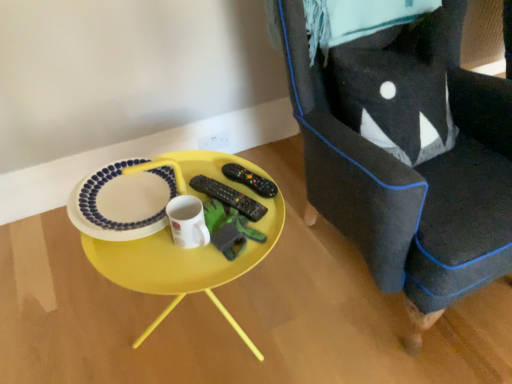
Where is `free spot below yellow plastic table at center (from a real-world perspective)`? Image resolution: width=512 pixels, height=384 pixels. free spot below yellow plastic table at center (from a real-world perspective) is located at coordinates (202, 331).